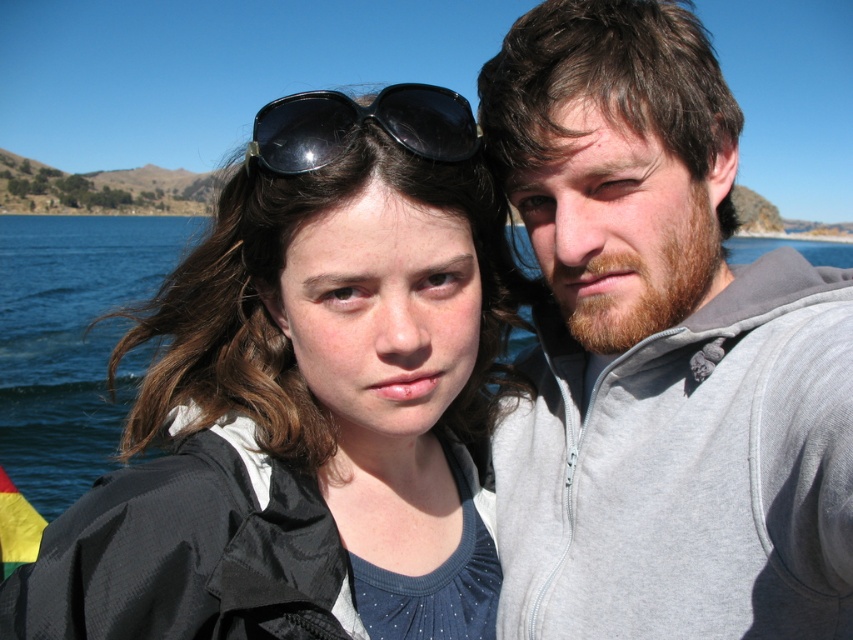
You are standing on the deck of a boat and want to know how far the point at coordinates (781, 566) is from you. Can you determine the distance?

The point at coordinates (781, 566) is 45.82 feet away from the viewer.